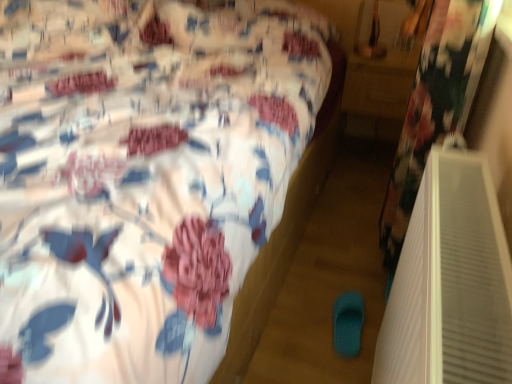
Question: Relative to wooden table at right, is teal rubber slipper at lower center in front or behind?

Choices:
 (A) behind
 (B) front

Answer: (B)

Question: Do you think teal rubber slipper at lower center is within wooden table at right, or outside of it?

Choices:
 (A) outside
 (B) inside

Answer: (A)

Question: Based on their relative distances, which object is nearer to the floral fabric bed at center?

Choices:
 (A) wooden table at right
 (B) teal rubber slipper at lower center

Answer: (B)

Question: Which is nearer to the wooden table at right?

Choices:
 (A) floral fabric bed at center
 (B) teal rubber slipper at lower center

Answer: (A)